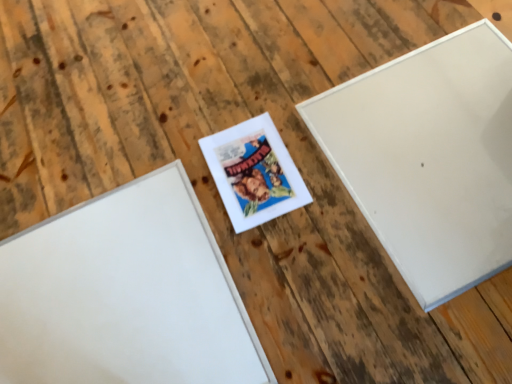
Locate an element on the screen. The width and height of the screenshot is (512, 384). vacant space behind white matte picture frame at center, positioned as the 3th picture frame in right-to-left order is located at coordinates (113, 126).